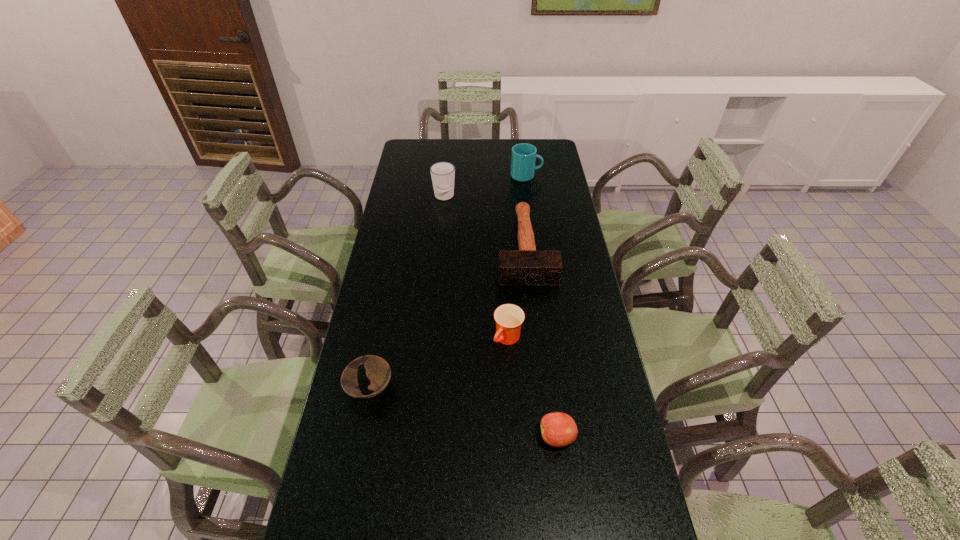
Choose which object is the third nearest neighbor to the second object from left to right. Please provide its 2D coordinates. Your answer should be formatted as a tuple, i.e. [(x, y)], where the tuple contains the x and y coordinates of a point satisfying the conditions above.

[(509, 318)]

Identify which object is located as the second nearest to the bowl. Please provide its 2D coordinates. Your answer should be formatted as a tuple, i.e. [(x, y)], where the tuple contains the x and y coordinates of a point satisfying the conditions above.

[(558, 429)]

Identify which cup is the second closest to the farthest object. Please provide its 2D coordinates. Your answer should be formatted as a tuple, i.e. [(x, y)], where the tuple contains the x and y coordinates of a point satisfying the conditions above.

[(509, 318)]

Locate which cup ranks second in proximity to the fifth nearest object. Please provide its 2D coordinates. Your answer should be formatted as a tuple, i.e. [(x, y)], where the tuple contains the x and y coordinates of a point satisfying the conditions above.

[(509, 318)]

Locate an element on the screen. The height and width of the screenshot is (540, 960). vacant space that satisfies the following two spatial constraints: 1. on the handle side of the farthest cup; 2. on the front side of the leftmost object is located at coordinates (555, 388).

Where is `free region that satisfies the following two spatial constraints: 1. with a handle on the side of the second nearest cup; 2. on the left side of the nearest object`? Image resolution: width=960 pixels, height=540 pixels. free region that satisfies the following two spatial constraints: 1. with a handle on the side of the second nearest cup; 2. on the left side of the nearest object is located at coordinates coord(420,437).

Image resolution: width=960 pixels, height=540 pixels. In order to click on vacant area in the image that satisfies the following two spatial constraints: 1. on the hammer head face of the third farthest object; 2. on the right side of the apple in this screenshot , I will do `click(546, 437)`.